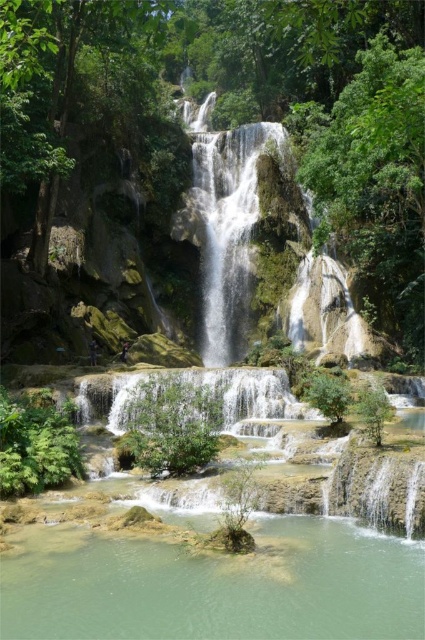
You are a hiker who wants to cross the waterfall area. You notice two distinct water bodies here, the clear water at center and the translucent white water at center. Which water body is wider so you can choose the safer path?

The clear water at center is wider than the translucent white water at center. Therefore, the clear water at center would be the safer path to cross as it is wider.

You are standing at the edge of the forest near the waterfall and want to locate the point at coordinates (x=218, y=586). According to the scene, where would this point be located in relation to the clear water at center?

The point at coordinates (x=218, y=586) is located on the clear water at center, so it is directly on the calm, reflective water area in the middle of the waterfall.